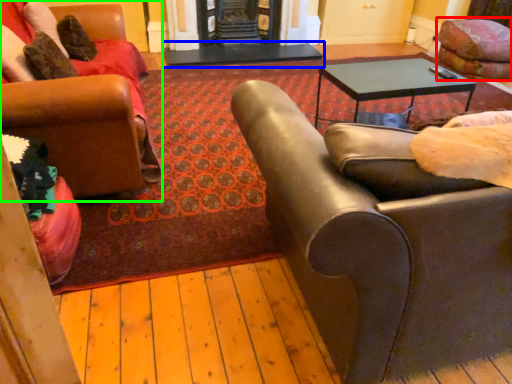
Question: Based on their relative distances, which object is farther from swivel chair (highlighted by a red box)? Choose from table (highlighted by a blue box) and chair (highlighted by a green box).

Choices:
 (A) table
 (B) chair

Answer: (B)